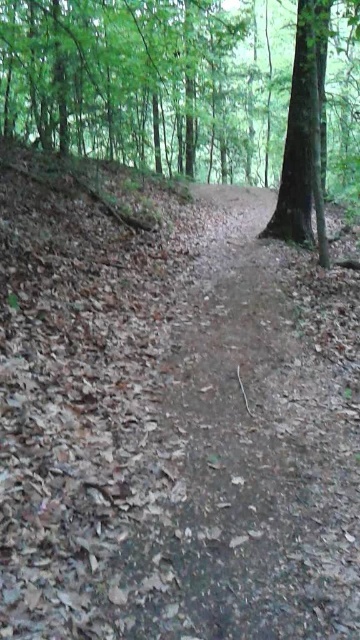
You are standing at the starting point of the forest trail and see the green leafy tree at upper center. If you were to walk directly towards the tree, would you be walking towards the upper part of the image?

Yes, since the green leafy tree at upper center is located at point (168, 88) in the image, walking towards it would mean moving towards the upper part of the image.

You are standing at the start of the forest trail and see the green leafy tree at upper center in the distance. If you want to reach the tree within 10 minutes, what is the minimum speed you need to walk at?

The green leafy tree at upper center is 40.22 feet away. To reach it within 10 minutes, you need to walk at a minimum speed of 0.4 feet per minute.

You are a hiker carrying a 10 meter long rope. You want to tie the rope between the green leafy tree at upper center and the green rough bark tree at upper right to mark the trail. Is the rope long enough to stretch between them?

The distance between the green leafy tree at upper center and the green rough bark tree at upper right is 8.38 meters. Since the rope is 10 meters long, it is long enough to stretch between them.